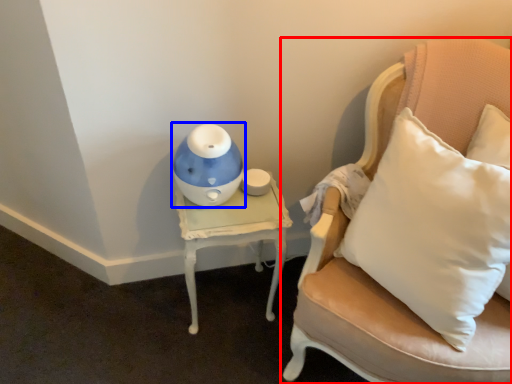
Question: Which object appears farthest to the camera in this image, chair (highlighted by a red box) or toy (highlighted by a blue box)?

Choices:
 (A) chair
 (B) toy

Answer: (B)